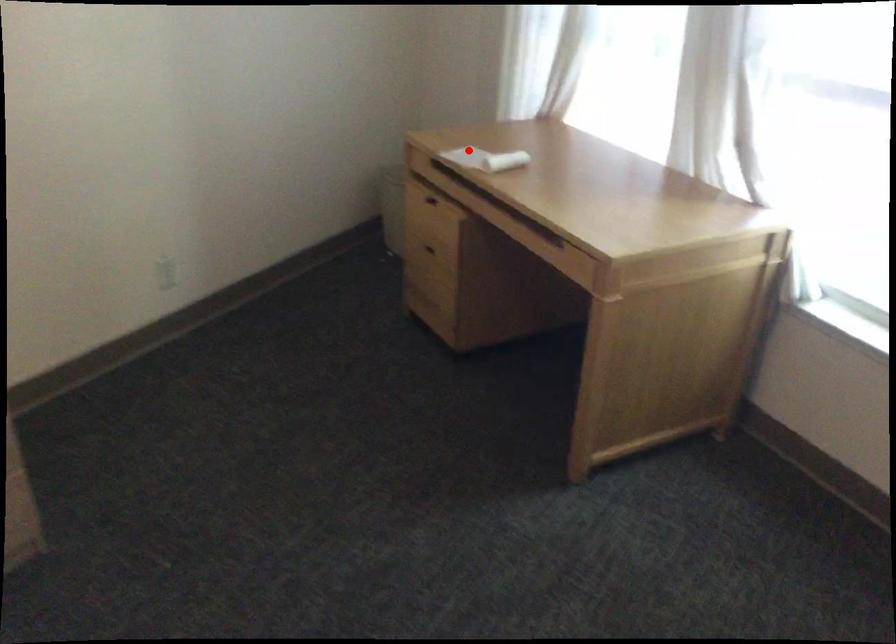
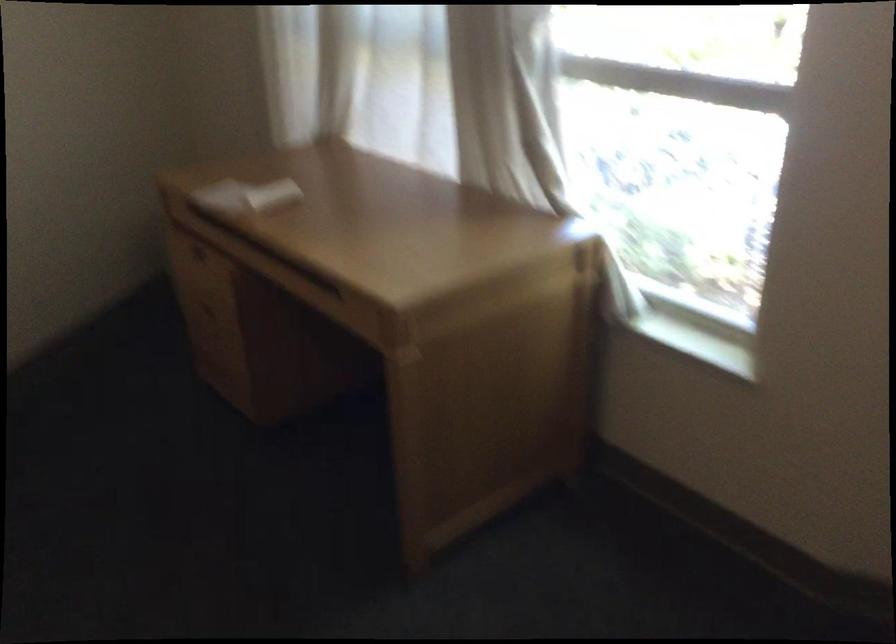
Question: I am providing you with two images of the same scene from different viewpoints. A red point is shown in image1. For the corresponding object point in image2, is it positioned nearer or farther from the camera?

Choices:
 (A) Nearer
 (B) Farther

Answer: (A)